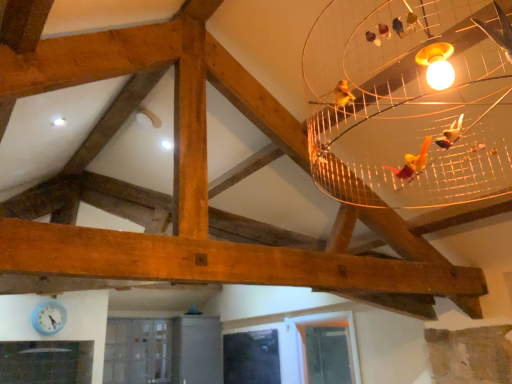
Question: Considering the relative sizes of transparent glass window at lower center, placed as the 2th window when sorted from front to back, and light blue plastic clock at lower left in the image provided, is transparent glass window at lower center, placed as the 2th window when sorted from front to back, smaller than light blue plastic clock at lower left?

Choices:
 (A) yes
 (B) no

Answer: (B)

Question: Can you confirm if transparent glass window at lower center, placed as the 2th window when sorted from front to back, is bigger than light blue plastic clock at lower left?

Choices:
 (A) yes
 (B) no

Answer: (A)

Question: From a real-world perspective, is transparent glass window at lower center, which appears as the 2th window when viewed from the right, located higher than light blue plastic clock at lower left?

Choices:
 (A) no
 (B) yes

Answer: (A)

Question: Considering the relative sizes of transparent glass window at lower center, which appears as the 2th window when viewed from the right, and light blue plastic clock at lower left in the image provided, is transparent glass window at lower center, which appears as the 2th window when viewed from the right, shorter than light blue plastic clock at lower left?

Choices:
 (A) no
 (B) yes

Answer: (A)

Question: Is transparent glass window at lower center, which is the 1th window from left to right, surrounding light blue plastic clock at lower left?

Choices:
 (A) yes
 (B) no

Answer: (B)

Question: From the image's perspective, is light blue plastic clock at lower left located above or below clear glass window at lower center, marked as the 1th window in a right-to-left arrangement?

Choices:
 (A) below
 (B) above

Answer: (B)

Question: In terms of height, does light blue plastic clock at lower left look taller or shorter compared to clear glass window at lower center, marked as the 1th window in a right-to-left arrangement?

Choices:
 (A) tall
 (B) short

Answer: (B)

Question: From a real-world perspective, is light blue plastic clock at lower left positioned above or below clear glass window at lower center, which is counted as the 2th window, starting from the left?

Choices:
 (A) above
 (B) below

Answer: (A)

Question: In the image, is light blue plastic clock at lower left positioned in front of or behind clear glass window at lower center, marked as the 1th window in a right-to-left arrangement?

Choices:
 (A) front
 (B) behind

Answer: (B)

Question: Does point (349, 317) appear closer or farther from the camera than point (280, 375)?

Choices:
 (A) closer
 (B) farther

Answer: (A)

Question: Looking at the image, does clear glass window at lower center, arranged as the second window when viewed from the back, seem bigger or smaller compared to transparent glass window at lower center, which is the 1th window from left to right?

Choices:
 (A) big
 (B) small

Answer: (A)

Question: In the image, is clear glass window at lower center, which is counted as the 2th window, starting from the left, positioned in front of or behind transparent glass window at lower center, placed as the 2th window when sorted from front to back?

Choices:
 (A) behind
 (B) front

Answer: (B)

Question: Visually, is clear glass window at lower center, marked as the 1th window in a right-to-left arrangement, positioned to the left or to the right of transparent glass window at lower center, which appears as the 2th window when viewed from the right?

Choices:
 (A) right
 (B) left

Answer: (A)

Question: Visually, is transparent glass window at lower center, placed as the 2th window when sorted from front to back, positioned to the left or to the right of light blue plastic clock at lower left?

Choices:
 (A) right
 (B) left

Answer: (A)

Question: Considering the positions of point (246, 372) and point (49, 311), is point (246, 372) closer or farther from the camera than point (49, 311)?

Choices:
 (A) farther
 (B) closer

Answer: (A)